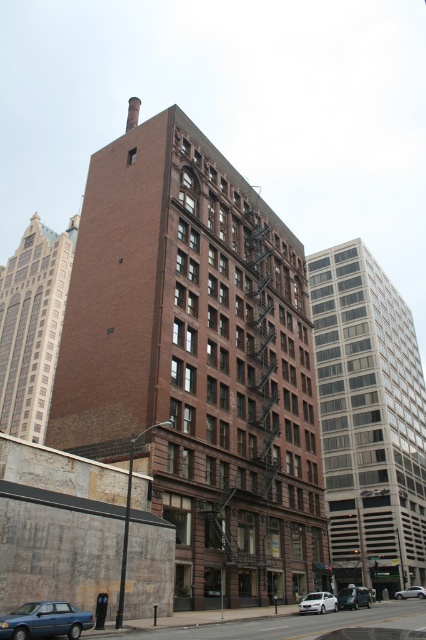
Does blue metallic sedan at lower left have a lesser width compared to silver metallic car at lower right?

Indeed, blue metallic sedan at lower left has a lesser width compared to silver metallic car at lower right.

Is blue metallic sedan at lower left further to camera compared to silver metallic car at lower right?

No, it is in front of silver metallic car at lower right.

Describe the element at coordinates (45, 620) in the screenshot. I see `blue metallic sedan at lower left` at that location.

You are a GUI agent. You are given a task and a screenshot of the screen. Output one action in this format:
    pyautogui.click(x=<x>, y=<y>)
    Task: Click on the blue metallic sedan at lower left
    Image resolution: width=426 pixels, height=640 pixels.
    Given the screenshot: What is the action you would take?
    pyautogui.click(x=45, y=620)

Based on the photo, is blue metallic sedan at lower left below silver metallic sedan at lower right?

No.

Does point (22, 632) come farther from viewer compared to point (348, 605)?

No, it is in front of (348, 605).

This screenshot has height=640, width=426. Find the location of `blue metallic sedan at lower left`. blue metallic sedan at lower left is located at coordinates (45, 620).

Is white matte car at lower center shorter than silver metallic car at lower right?

Incorrect, white matte car at lower center's height does not fall short of silver metallic car at lower right's.

Is white matte car at lower center wider than silver metallic car at lower right?

Yes, white matte car at lower center is wider than silver metallic car at lower right.

What do you see at coordinates (317, 602) in the screenshot? This screenshot has width=426, height=640. I see `white matte car at lower center` at bounding box center [317, 602].

Locate an element on the screen. This screenshot has width=426, height=640. white matte car at lower center is located at coordinates (317, 602).